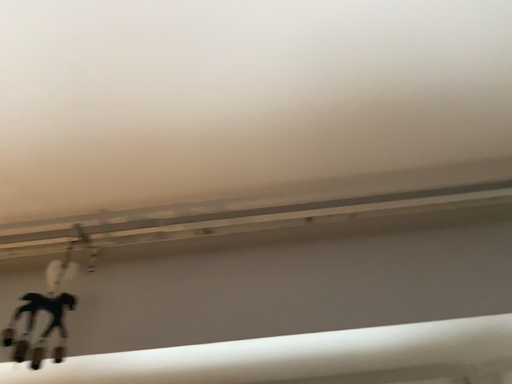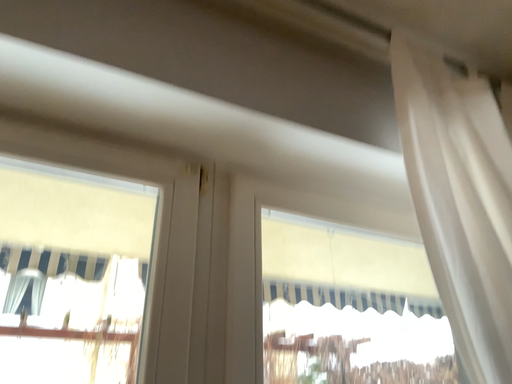
Question: Which way did the camera rotate in the video?

Choices:
 (A) rotated upward
 (B) rotated downward

Answer: (B)